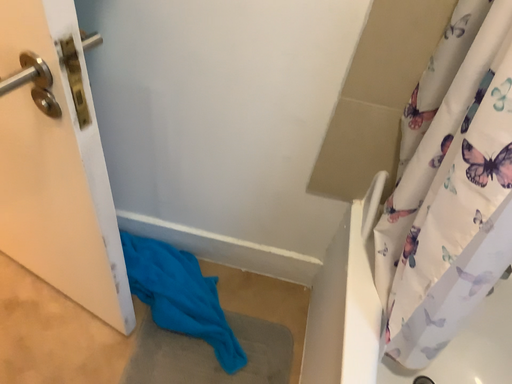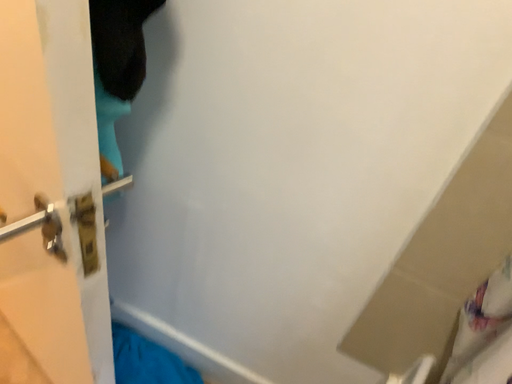
Question: How did the camera likely rotate when shooting the video?

Choices:
 (A) rotated upward
 (B) rotated downward

Answer: (A)